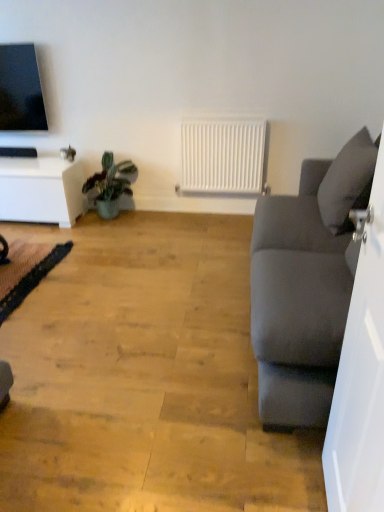
Find the location of a particular element. The image size is (384, 512). vacant area situated below white matte radiator at center (from a real-world perspective) is located at coordinates (211, 207).